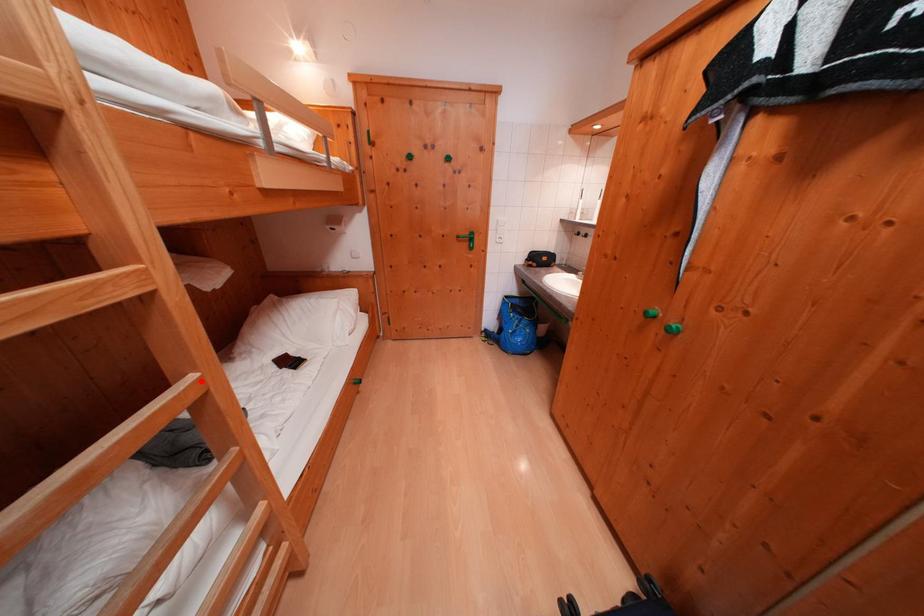
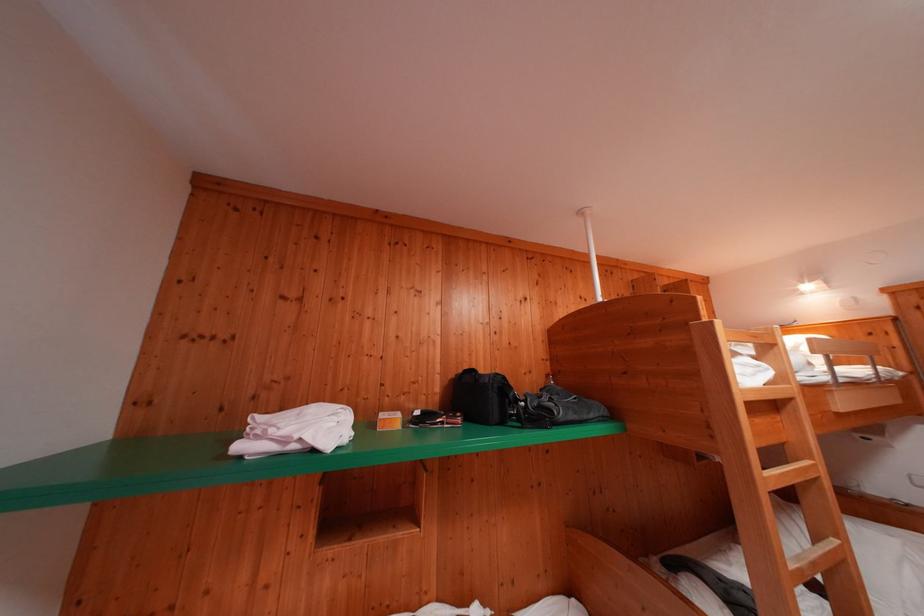
Question: I am providing you with two images of the same scene from different viewpoints. Given a red point in image1, look at the same physical point in image2. Is it:

Choices:
 (A) Closer to the viewpoint
 (B) Farther from the viewpoint

Answer: (A)